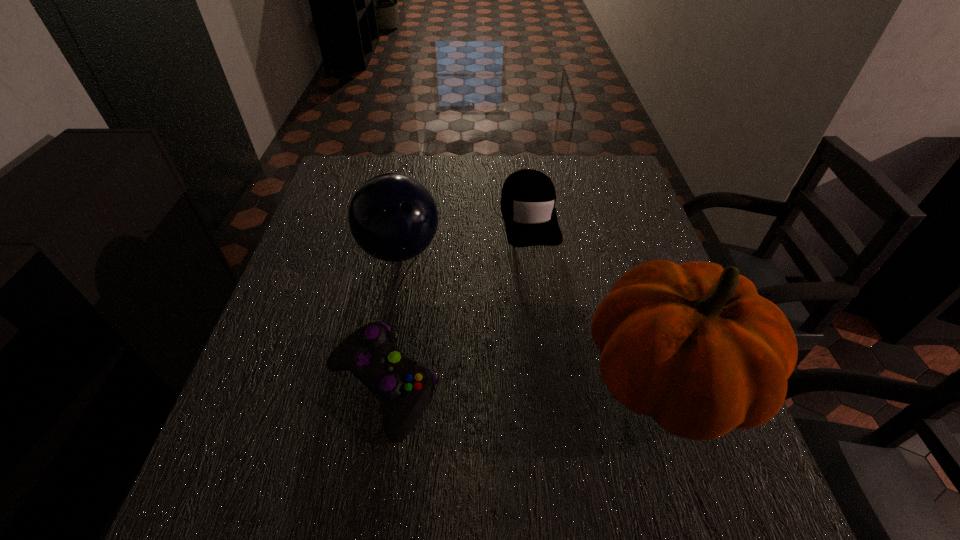
Where is `control`? control is located at coordinates (404, 387).

Image resolution: width=960 pixels, height=540 pixels. Identify the location of the tallest object. click(x=694, y=346).

Image resolution: width=960 pixels, height=540 pixels. I want to click on bowling ball, so click(x=393, y=217).

The height and width of the screenshot is (540, 960). Identify the location of the third tallest object. 528,198.

Where is `free location located on the right of the shortest object`? free location located on the right of the shortest object is located at coordinates (x=606, y=388).

Where is `blank space located on the back of the pumpkin`? This screenshot has width=960, height=540. blank space located on the back of the pumpkin is located at coordinates (623, 242).

Where is `vacant space located 0.250m on the surface of the bowling ball near the finger holes`? This screenshot has width=960, height=540. vacant space located 0.250m on the surface of the bowling ball near the finger holes is located at coordinates [493, 336].

You are a GUI agent. You are given a task and a screenshot of the screen. Output one action in this format:
    pyautogui.click(x=<x>, y=<y>)
    Task: Click on the vacant space situated 0.320m on the surface of the bowling ball near the finger holes
    
    Given the screenshot: What is the action you would take?
    pyautogui.click(x=516, y=357)

In order to click on vacant space situated 0.240m on the surface of the bowling ball near the finger holes in this screenshot , I will do `click(490, 334)`.

Where is `vacant region located 0.310m on the front-facing side of the cap`? vacant region located 0.310m on the front-facing side of the cap is located at coordinates (560, 350).